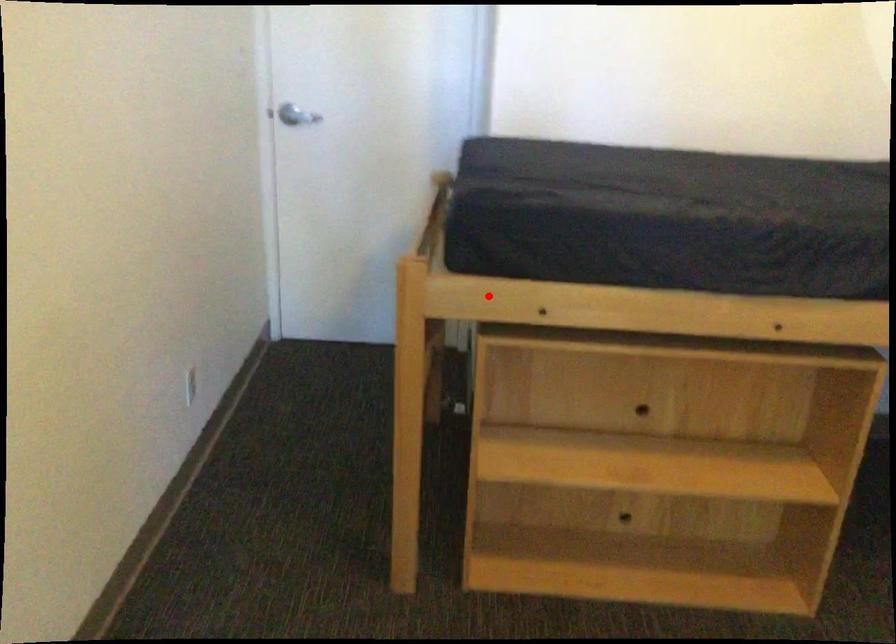
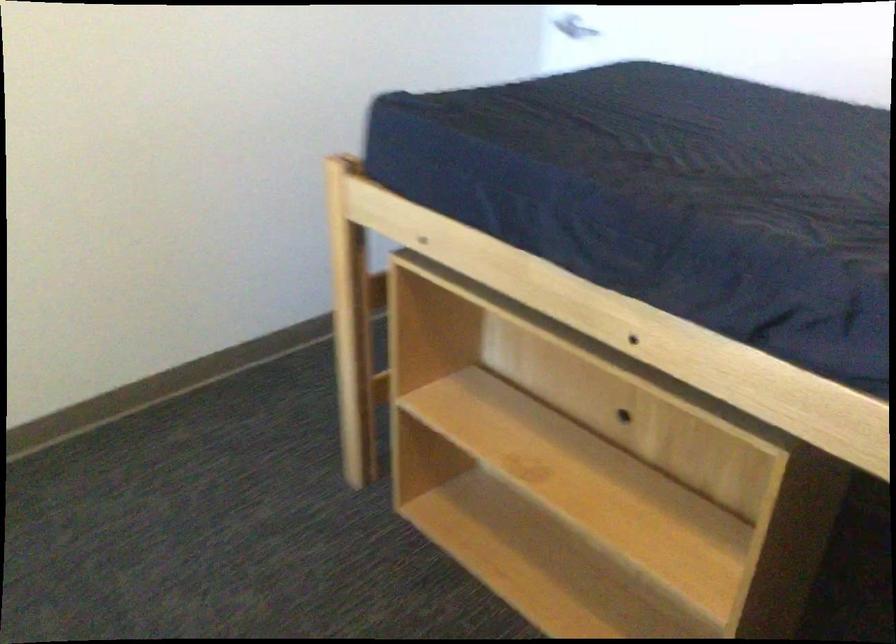
The point at the highlighted location is marked in the first image. Where is the corresponding point in the second image?

(392, 214)